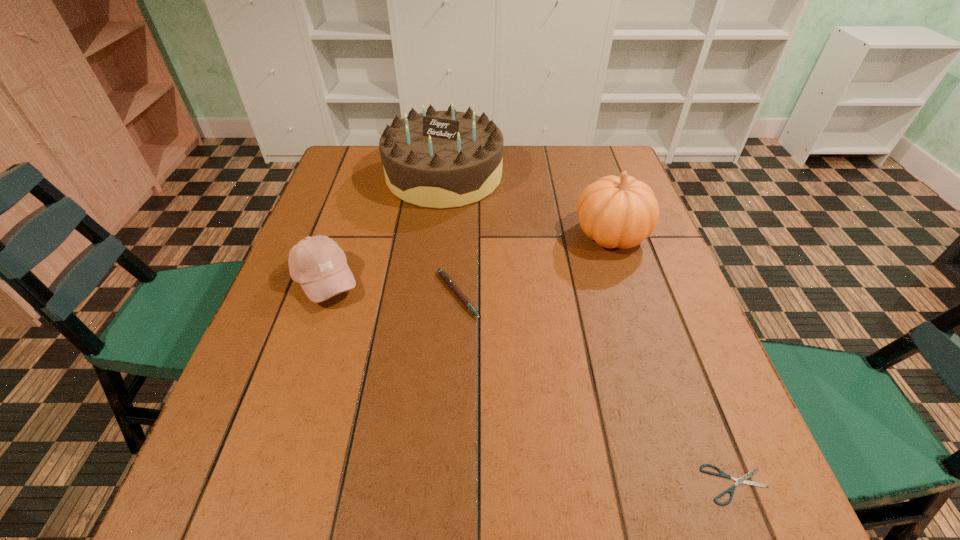
Where is `vacant area between the fourth tallest object and the nearest object`? The height and width of the screenshot is (540, 960). vacant area between the fourth tallest object and the nearest object is located at coordinates (597, 389).

Locate which object ranks third in proximity to the second shortest object. Please provide its 2D coordinates. Your answer should be formatted as a tuple, i.e. [(x, y)], where the tuple contains the x and y coordinates of a point satisfying the conditions above.

[(621, 212)]

The image size is (960, 540). Identify the location of object that stands as the third closest to the birthday cake. (444, 276).

This screenshot has height=540, width=960. In order to click on vacant space that satisfies the following two spatial constraints: 1. on the front-facing side of the nearest object; 2. on the right side of the farthest object in this screenshot , I will do `click(411, 484)`.

The height and width of the screenshot is (540, 960). I want to click on vacant space that satisfies the following two spatial constraints: 1. on the front-facing side of the birthday cake; 2. on the front-facing side of the baseball cap, so [433, 281].

Where is `blank space that satisfies the following two spatial constraints: 1. on the front-facing side of the farthest object; 2. on the left side of the pumpkin`? blank space that satisfies the following two spatial constraints: 1. on the front-facing side of the farthest object; 2. on the left side of the pumpkin is located at coordinates (438, 235).

Locate an element on the screen. This screenshot has height=540, width=960. blank area in the image that satisfies the following two spatial constraints: 1. on the front-facing side of the pumpkin; 2. on the left side of the birthday cake is located at coordinates (438, 235).

What are the coordinates of `vacant space that satisfies the following two spatial constraints: 1. on the front-facing side of the baseball cap; 2. on the right side of the shears` in the screenshot? It's located at (254, 484).

In order to click on free space in the image that satisfies the following two spatial constraints: 1. at the nib of the second shortest object; 2. on the back side of the shortest object in this screenshot , I will do `click(448, 484)`.

Locate an element on the screen. This screenshot has width=960, height=540. vacant space that satisfies the following two spatial constraints: 1. at the nib of the second shortest object; 2. on the back side of the shortest object is located at coordinates (448, 484).